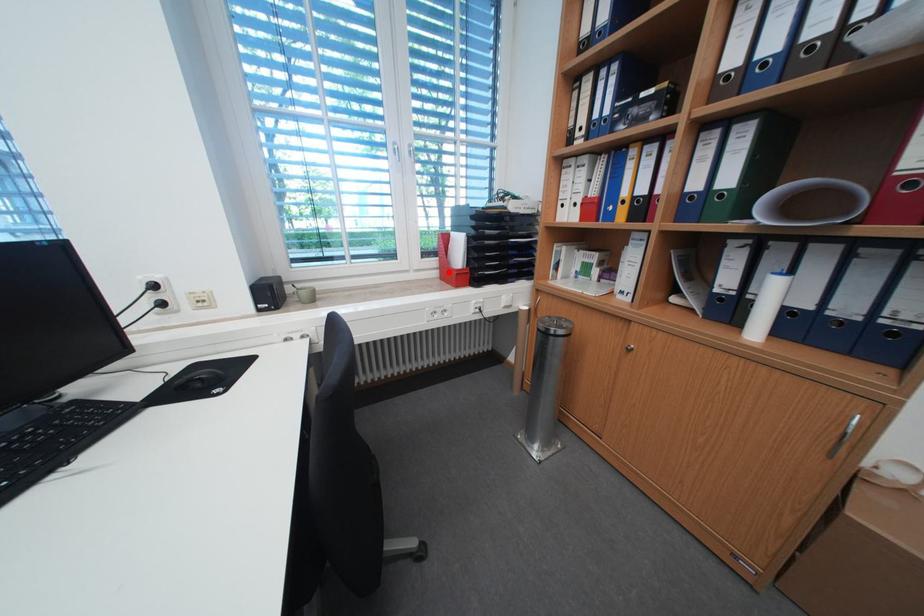
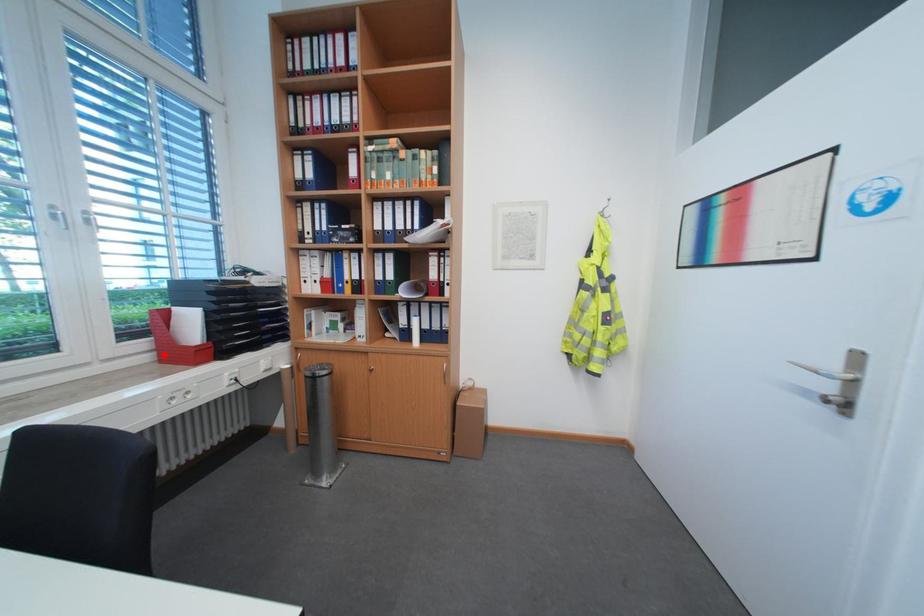
I am providing you with two images of the same scene from different viewpoints. A red point is marked on the first image and another point is marked on the second image. Does the point marked in image1 correspond to the same location as the one in image2?

Yes